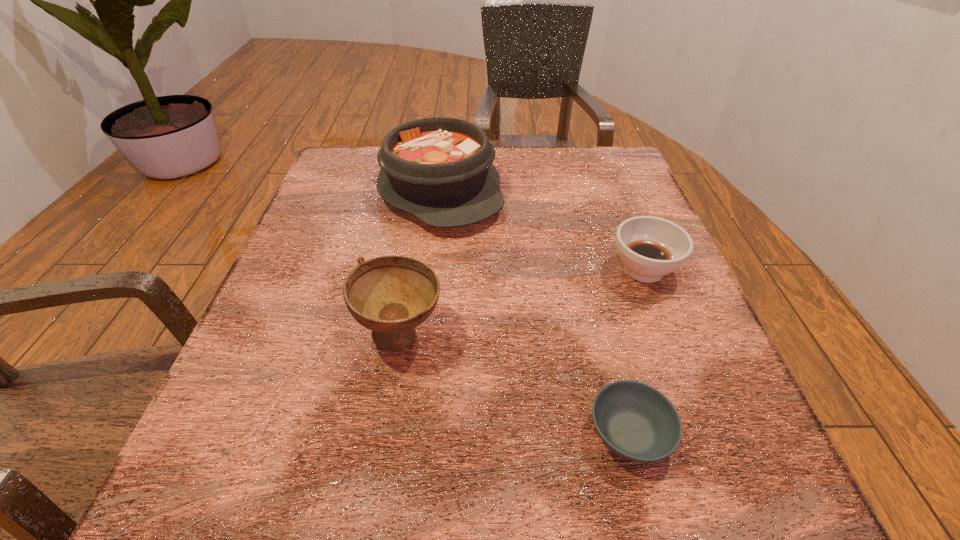
The image size is (960, 540). I want to click on object that ranks as the third closest to the shortest object, so click(x=439, y=169).

At what (x,y) coordinates should I click in order to perform the action: click on the second closest object relative to the farthest object. Please return your answer as a coordinate pair (x, y). Looking at the image, I should click on (650, 247).

Image resolution: width=960 pixels, height=540 pixels. Identify the location of soup bowl that stands as the second closest to the second farthest object. (391, 295).

Where is `the second closest soup bowl relative to the casserole`? the second closest soup bowl relative to the casserole is located at coordinates (650, 247).

Image resolution: width=960 pixels, height=540 pixels. I want to click on vacant space that satisfies the following two spatial constraints: 1. on the back side of the second farthest object; 2. on the right side of the nearest object, so click(x=588, y=269).

What are the coordinates of `blank space that satisfies the following two spatial constraints: 1. on the back side of the leftmost soup bowl; 2. on the left side of the casserole` in the screenshot? It's located at (424, 190).